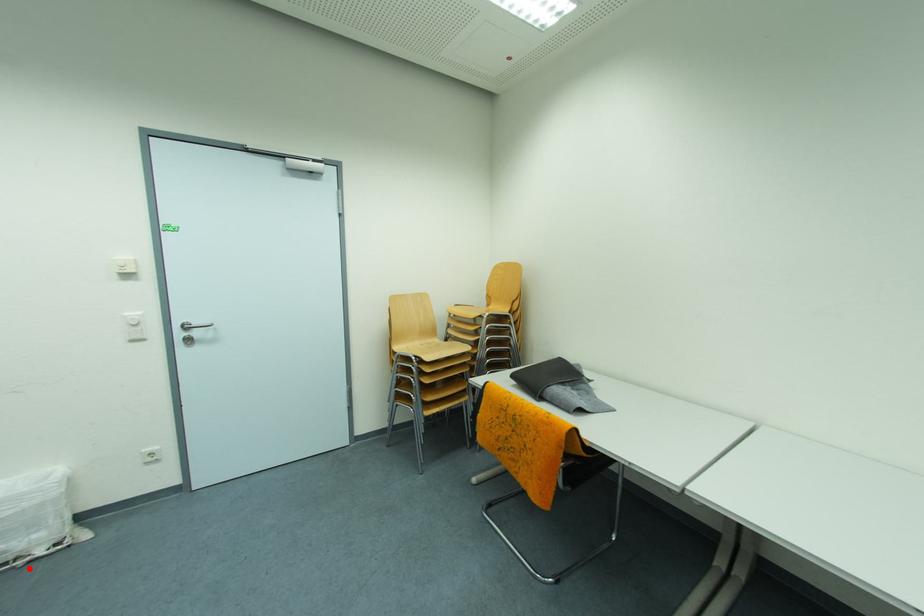
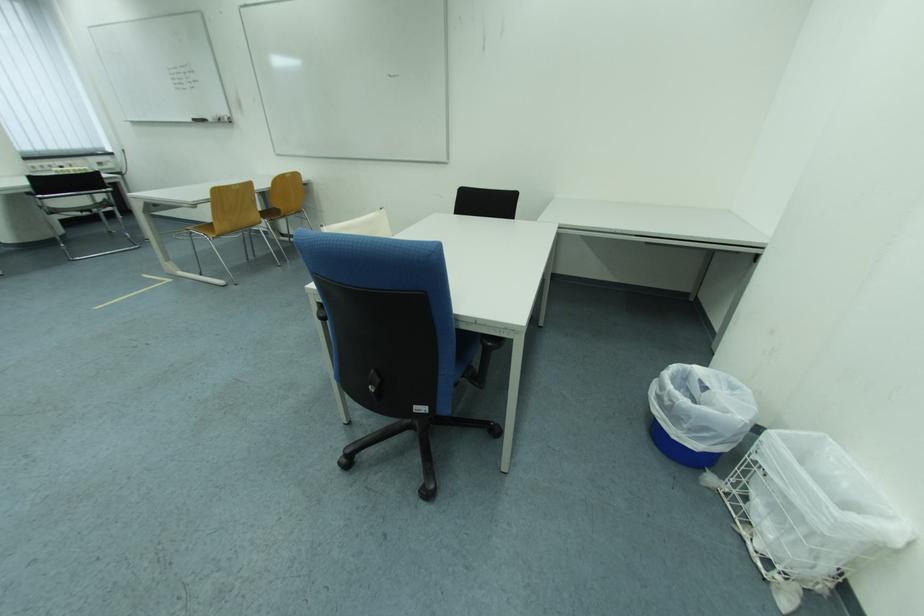
Where in the second image is the point corresponding to the highlighted location from the first image?

(745, 532)